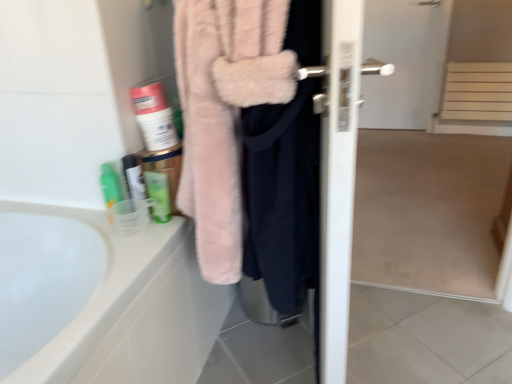
Question: From a real-world perspective, is fuzzy pink robe at center positioned under fluffy pink towel at upper right based on gravity?

Choices:
 (A) yes
 (B) no

Answer: (A)

Question: From the image's perspective, is fuzzy pink robe at center under fluffy pink towel at upper right?

Choices:
 (A) yes
 (B) no

Answer: (B)

Question: Is fuzzy pink robe at center smaller than fluffy pink towel at upper right?

Choices:
 (A) yes
 (B) no

Answer: (A)

Question: Is fuzzy pink robe at center looking in the opposite direction of fluffy pink towel at upper right?

Choices:
 (A) yes
 (B) no

Answer: (A)

Question: Can you confirm if fuzzy pink robe at center is bigger than fluffy pink towel at upper right?

Choices:
 (A) yes
 (B) no

Answer: (B)

Question: Considering the relative sizes of fuzzy pink robe at center and fluffy pink towel at upper right in the image provided, is fuzzy pink robe at center wider than fluffy pink towel at upper right?

Choices:
 (A) yes
 (B) no

Answer: (B)

Question: Considering the relative sizes of fuzzy pink robe at center and translucent plastic cup at lower left, the second toiletry positioned from the left, in the image provided, is fuzzy pink robe at center wider than translucent plastic cup at lower left, the second toiletry positioned from the left,?

Choices:
 (A) yes
 (B) no

Answer: (A)

Question: Is fuzzy pink robe at center oriented towards translucent plastic cup at lower left, the second toiletry positioned from the left?

Choices:
 (A) no
 (B) yes

Answer: (B)

Question: Does fuzzy pink robe at center come behind translucent plastic cup at lower left, the second toiletry positioned from the left?

Choices:
 (A) yes
 (B) no

Answer: (B)

Question: Can you confirm if fuzzy pink robe at center is smaller than translucent plastic cup at lower left, the second toiletry positioned from the left?

Choices:
 (A) no
 (B) yes

Answer: (A)

Question: From the image's perspective, does fuzzy pink robe at center appear lower than translucent plastic cup at lower left, placed as the second toiletry when sorted from right to left?

Choices:
 (A) yes
 (B) no

Answer: (B)

Question: Is fuzzy pink robe at center outside translucent plastic cup at lower left, the second toiletry positioned from the left?

Choices:
 (A) no
 (B) yes

Answer: (B)

Question: Can you confirm if white matte screen door at center is positioned to the right of translucent plastic cup at lower left, arranged as the 1th toiletry when viewed from the left?

Choices:
 (A) no
 (B) yes

Answer: (B)